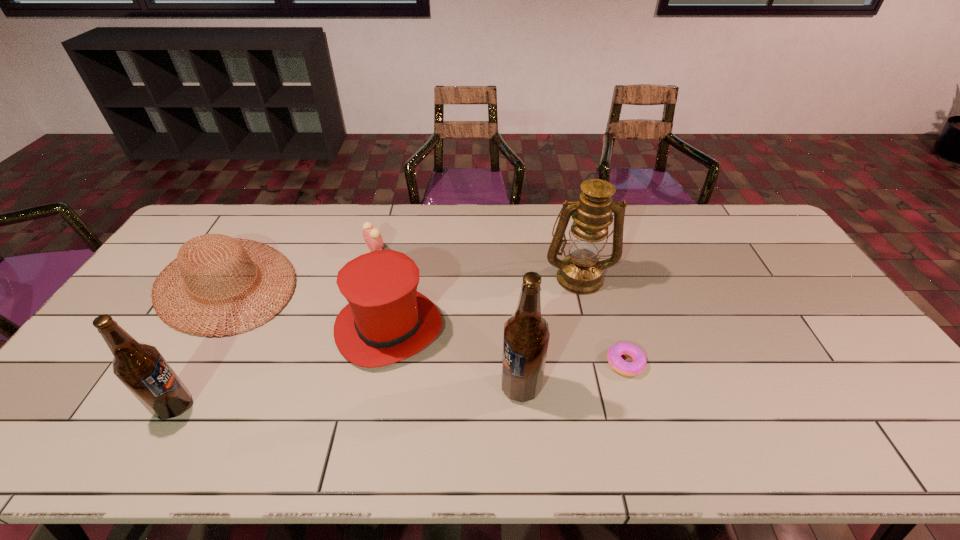
Locate an element on the screen. Image resolution: width=960 pixels, height=540 pixels. vacant area that lies between the sixth tallest object and the shorter beer bottle is located at coordinates (275, 328).

Locate an element on the screen. vacant region between the shorter beer bottle and the fourth shortest object is located at coordinates (281, 367).

You are a GUI agent. You are given a task and a screenshot of the screen. Output one action in this format:
    pyautogui.click(x=<x>, y=<y>)
    Task: Click on the free area in between the oil lamp and the second shortest object
    Image resolution: width=960 pixels, height=540 pixels.
    Given the screenshot: What is the action you would take?
    pyautogui.click(x=477, y=263)

Locate an element on the screen. Image resolution: width=960 pixels, height=540 pixels. object that is the fifth closest to the fifth tallest object is located at coordinates (580, 272).

Locate an element on the screen. the fourth closest object to the doughnut is located at coordinates (372, 236).

You are a GUI agent. You are given a task and a screenshot of the screen. Output one action in this format:
    pyautogui.click(x=<x>, y=<y>)
    Task: Click on the vacant space that satisfies the following two spatial constraints: 1. on the face of the alarm clock; 2. on the front side of the third shortest object
    
    Given the screenshot: What is the action you would take?
    pyautogui.click(x=366, y=284)

At what (x,y) coordinates should I click in order to perform the action: click on free location that satisfies the following two spatial constraints: 1. on the back side of the fifth tallest object; 2. on the left side of the oil lamp. Please return your answer as a coordinate pair (x, y). The width and height of the screenshot is (960, 540). Looking at the image, I should click on (230, 276).